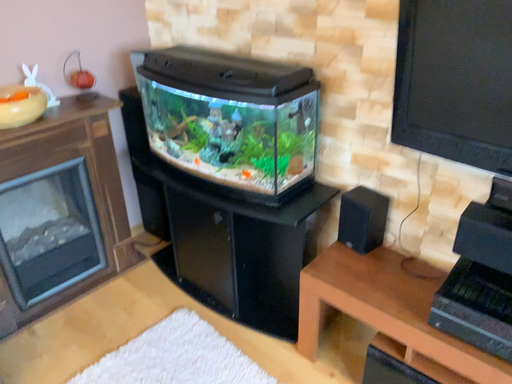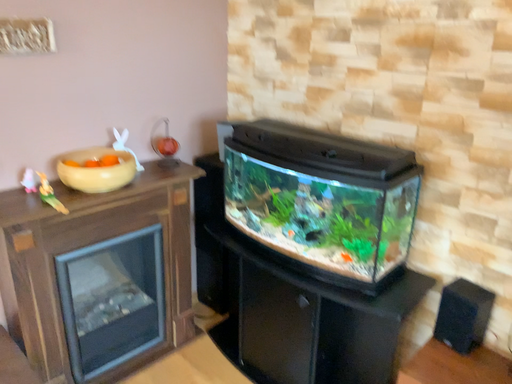
Question: Which way did the camera rotate in the video?

Choices:
 (A) rotated downward
 (B) rotated upward

Answer: (B)